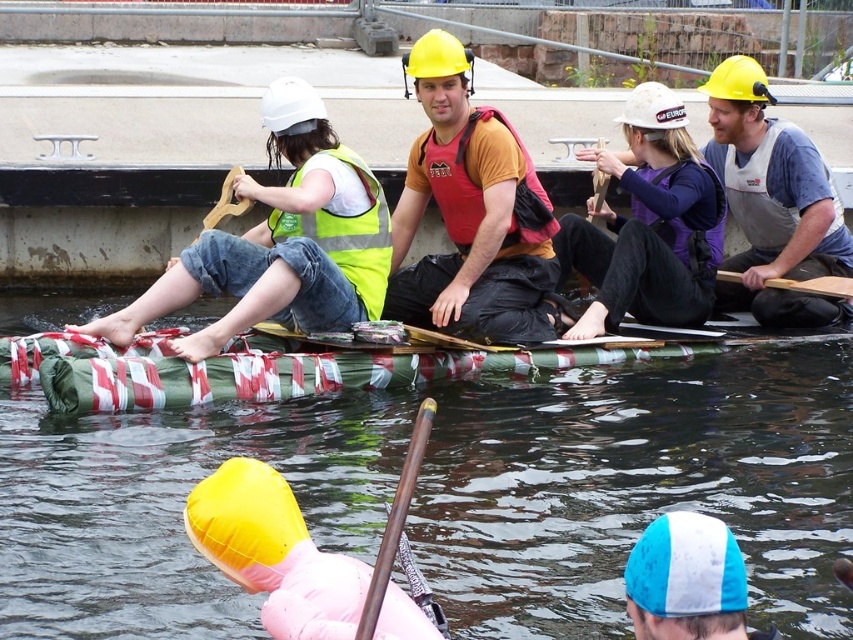
You are standing at the starting point of the rafting activity and see two points marked on the raft. Which point is closer to you? The points are labeled as point 1 at coordinates point [669,177] and point 2 at coordinates point [364,636].

Point 2 at coordinates point [364,636] is closer to you because point 1 at coordinates point [669,177] is behind it.

You are a safety inspector checking the raft for compliance. You notice two safety vests on the raft. Which vest, the matte gray vest at center or the high visibility fabric safety vest at left, is bigger in size?

The matte gray vest at center has a larger size compared to the high visibility fabric safety vest at left, so the matte gray vest at center is bigger in size.

You are a safety inspector evaluating the raft builders. You notice two safety vests in the scene. Which vest, the matte gray vest at center or the high visibility fabric safety vest at left, is positioned higher up in the image?

The matte gray vest at center is taller than the high visibility fabric safety vest at left, so the matte gray vest at center is positioned higher up in the image.